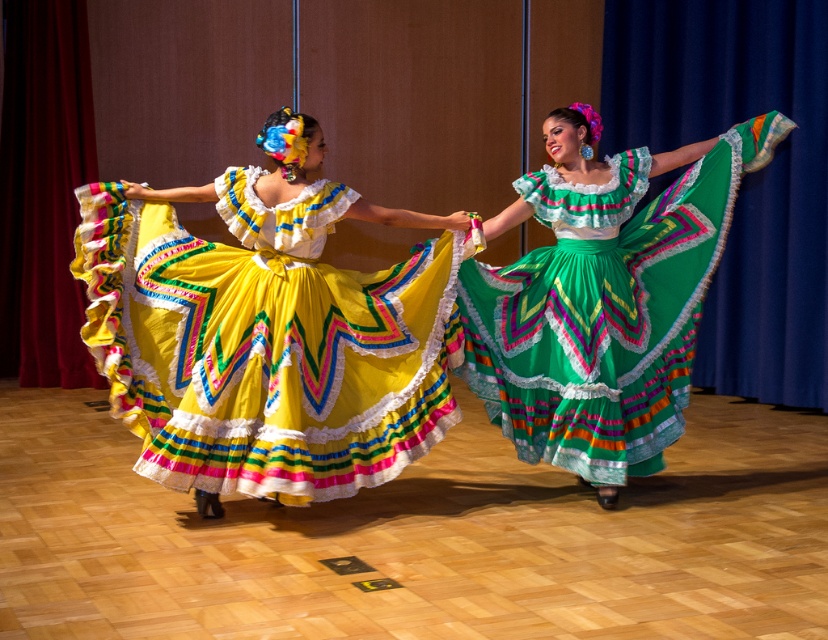
You are a photographer positioned at the back of the stage. You want to take a photo of both the matte yellow dress at center and the green satin skirt at center. Which one will appear larger in your photo?

The matte yellow dress at center will appear larger in the photo because it is closer to the viewer than the green satin skirt at center.

You are a photographer standing in front of the stage. You want to capture a closeup shot of the matte yellow dress at center. Given that your camera can focus on objects within 10 feet, will you be able to take the closeup without moving closer?

The distance between the matte yellow dress at center and the camera is 12.61 feet, which is beyond the camera focus range of 10 feet. Therefore, you cannot take the closeup without moving closer.

You are a photographer standing at the center of the stage, and you want to take a photo of both point (414, 317) and point (626, 440). Which point will appear larger in the photo?

Point (414, 317) is closer to the viewer than point (626, 440), so it will appear larger in the photo.